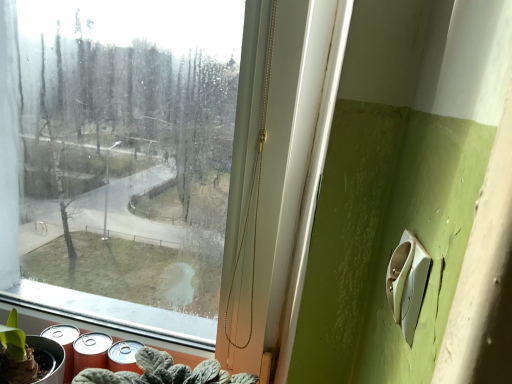
Question: From the image's perspective, is metallic silver spray can at lower left located above or below white plastic light switch at lower right?

Choices:
 (A) above
 (B) below

Answer: (B)

Question: In the image, is metallic silver spray can at lower left on the left side or the right side of white plastic light switch at lower right?

Choices:
 (A) left
 (B) right

Answer: (A)

Question: Based on their relative distances, which object is nearer to the metallic silver spray can at lower left?

Choices:
 (A) white plastic light switch at lower right
 (B) transparent glass window at center
 (C) green matte plant at lower left

Answer: (C)

Question: Which object is positioned closest to the metallic silver spray can at lower left?

Choices:
 (A) transparent glass window at center
 (B) white plastic light switch at lower right
 (C) green matte plant at lower left

Answer: (C)